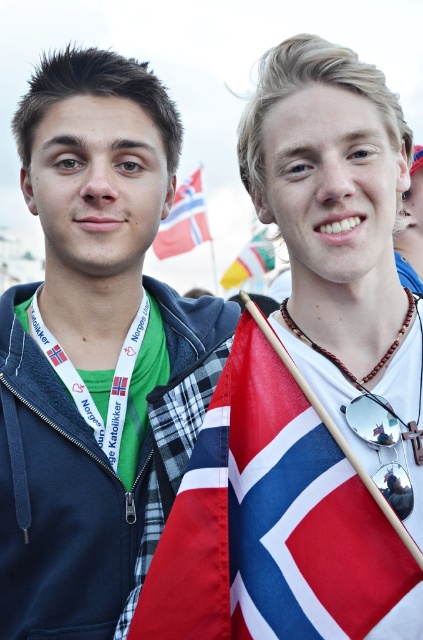
Between point (7, 346) and point (307, 636), which one is positioned behind?

Positioned behind is point (7, 346).

Locate an element on the screen. This screenshot has width=423, height=640. blue zip-up hoodie at left is located at coordinates (96, 353).

Who is lower down, blue zip-up hoodie at left or silver reflective sunglasses at center?

silver reflective sunglasses at center is lower down.

Between point (87, 310) and point (397, 454), which one is positioned behind?

Point (87, 310)

Find the location of a particular element. blue zip-up hoodie at left is located at coordinates (96, 353).

Between red fabric flag at center and silver reflective sunglasses at center, which one has less height?

silver reflective sunglasses at center

Measure the distance between point (279,547) and camera.

A distance of 31.77 meters exists between point (279,547) and camera.

Where is `red fabric flag at center`? red fabric flag at center is located at coordinates (277, 520).